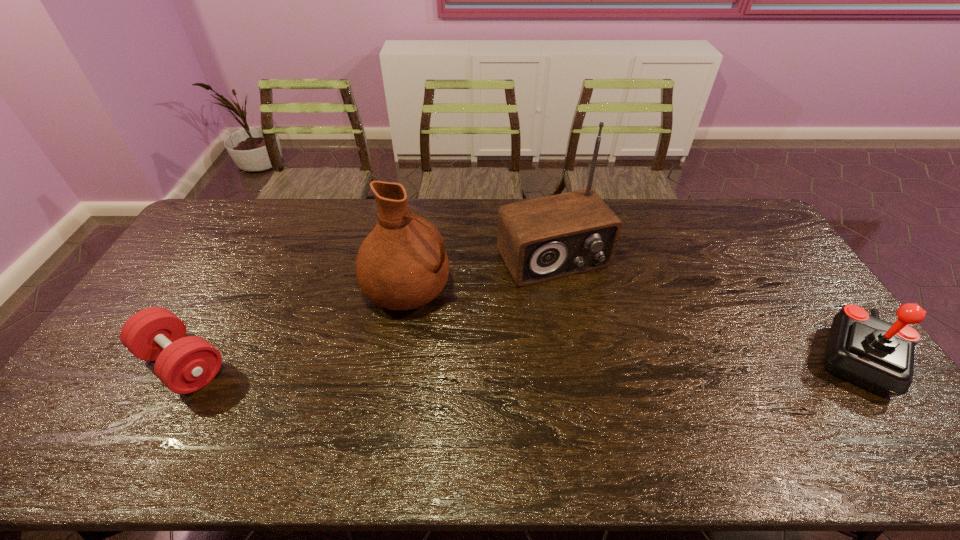
The width and height of the screenshot is (960, 540). What are the coordinates of `blank space located 0.080m on the side of the third shortest object with the handle` in the screenshot? It's located at [x=466, y=316].

I want to click on free space located 0.280m on the side of the third shortest object with the handle, so click(x=525, y=344).

You are a GUI agent. You are given a task and a screenshot of the screen. Output one action in this format:
    pyautogui.click(x=<x>, y=<y>)
    Task: Click on the vacant space positioned on the front-facing side of the radio receiver
    
    Given the screenshot: What is the action you would take?
    pyautogui.click(x=640, y=384)

You are a GUI agent. You are given a task and a screenshot of the screen. Output one action in this format:
    pyautogui.click(x=<x>, y=<y>)
    Task: Click on the free spot located 0.060m on the front-facing side of the radio receiver
    
    Given the screenshot: What is the action you would take?
    pyautogui.click(x=586, y=300)

Where is `vacant space located 0.270m on the front-facing side of the radio receiver`? Image resolution: width=960 pixels, height=540 pixels. vacant space located 0.270m on the front-facing side of the radio receiver is located at coordinates (621, 354).

Where is `object that is at the far edge`? This screenshot has width=960, height=540. object that is at the far edge is located at coordinates (542, 239).

You are a GUI agent. You are given a task and a screenshot of the screen. Output one action in this format:
    pyautogui.click(x=<x>, y=<y>)
    Task: Click on the dumbbell located in the near edge section of the desktop
    The height and width of the screenshot is (540, 960).
    Given the screenshot: What is the action you would take?
    pyautogui.click(x=184, y=364)

Identify the location of joystick that is positioned at the near edge. (877, 355).

The image size is (960, 540). Find the location of `object that is at the left edge`. object that is at the left edge is located at coordinates (184, 364).

In order to click on object situated at the right edge in this screenshot , I will do [877, 355].